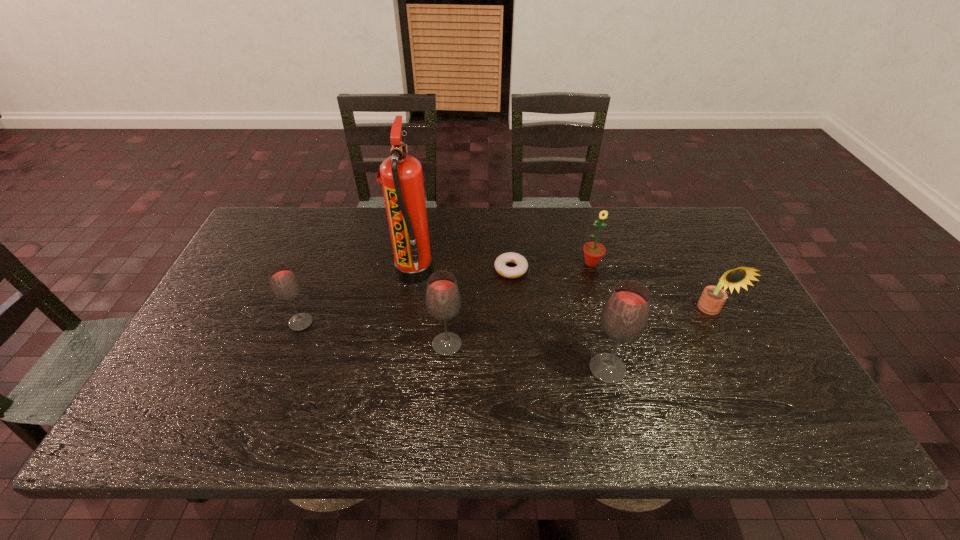
At what (x,y) coordinates should I click in order to perform the action: click on the tallest object. Please return your answer as a coordinate pair (x, y). This screenshot has height=540, width=960. Looking at the image, I should click on (401, 175).

The image size is (960, 540). In order to click on the left sunflower in this screenshot , I will do `click(593, 252)`.

Image resolution: width=960 pixels, height=540 pixels. In order to click on vacant area situated on the right of the leftmost glass drink container in this screenshot , I will do `click(405, 322)`.

The image size is (960, 540). What are the coordinates of `vacant space situated on the right of the second tallest glass drink container` in the screenshot? It's located at (539, 345).

Locate an element on the screen. The image size is (960, 540). free space located 0.070m on the left of the rightmost glass drink container is located at coordinates (559, 369).

Find the location of `vacant space situated on the back of the doughnut`. vacant space situated on the back of the doughnut is located at coordinates (510, 248).

I want to click on free spot located on the face of the nearer sunflower, so click(x=750, y=389).

Locate an element on the screen. vacant position located with the nozzle pointing from the back of the fire extinguisher is located at coordinates (477, 272).

I want to click on vacant area located 0.280m on the face of the left sunflower, so click(614, 347).

Where is `object situated at the near edge`? The height and width of the screenshot is (540, 960). object situated at the near edge is located at coordinates (625, 315).